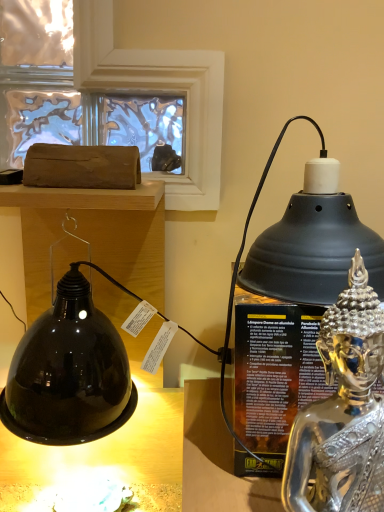
Question: Should I look upward or downward to see silver metallic statue at right?

Choices:
 (A) down
 (B) up

Answer: (A)

Question: Could you tell me if matte brown log at upper left is turned towards silver metallic statue at right?

Choices:
 (A) no
 (B) yes

Answer: (A)

Question: Is matte brown log at upper left outside silver metallic statue at right?

Choices:
 (A) yes
 (B) no

Answer: (A)

Question: Would you say silver metallic statue at right is part of matte brown log at upper left's contents?

Choices:
 (A) no
 (B) yes

Answer: (A)

Question: Does matte brown log at upper left appear on the left side of silver metallic statue at right?

Choices:
 (A) no
 (B) yes

Answer: (B)

Question: Are matte brown log at upper left and silver metallic statue at right far apart?

Choices:
 (A) yes
 (B) no

Answer: (B)

Question: Is matte brown log at upper left further to camera compared to silver metallic statue at right?

Choices:
 (A) yes
 (B) no

Answer: (A)

Question: From a real-world perspective, is matte brown log at upper left positioned under shiny metallic oil lamp at right based on gravity?

Choices:
 (A) no
 (B) yes

Answer: (A)

Question: Is matte brown log at upper left outside of shiny metallic oil lamp at right?

Choices:
 (A) yes
 (B) no

Answer: (A)

Question: Does matte brown log at upper left appear on the right side of shiny metallic oil lamp at right?

Choices:
 (A) no
 (B) yes

Answer: (A)

Question: From the image's perspective, is matte brown log at upper left over shiny metallic oil lamp at right?

Choices:
 (A) yes
 (B) no

Answer: (A)

Question: Are matte brown log at upper left and shiny metallic oil lamp at right beside each other?

Choices:
 (A) no
 (B) yes

Answer: (A)

Question: Is matte brown log at upper left positioned in front of shiny metallic oil lamp at right?

Choices:
 (A) no
 (B) yes

Answer: (A)

Question: Can you confirm if silver metallic statue at right is shorter than matte brown log at upper left?

Choices:
 (A) yes
 (B) no

Answer: (A)